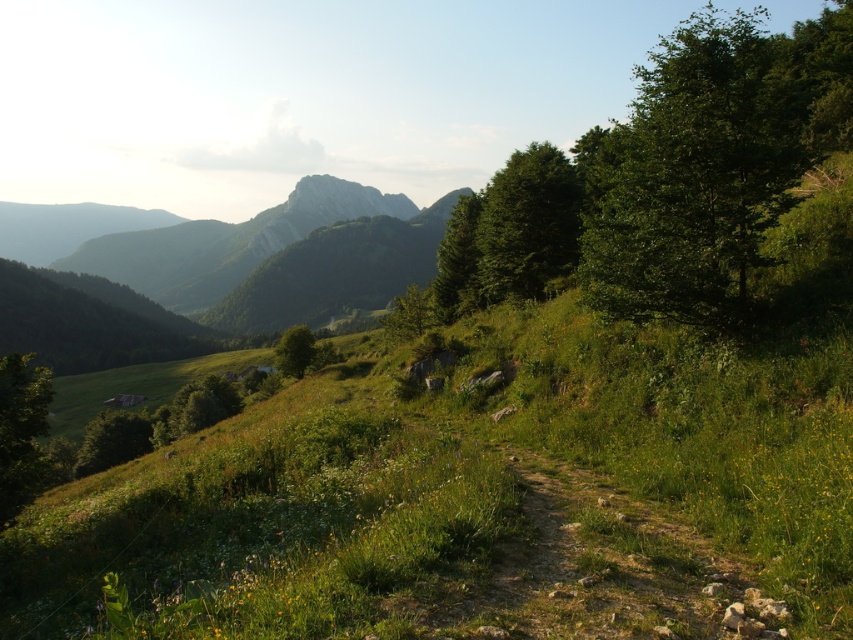
Question: Which of the following is the farthest from the observer?

Choices:
 (A) dirt/gravel path at center
 (B) rugged granite mountain at upper center

Answer: (B)

Question: Among these objects, which one is farthest from the camera?

Choices:
 (A) green leafy tree at lower left
 (B) rugged granite mountain at upper center

Answer: (B)

Question: Is rugged granite mountain at upper center wider than green leafy tree at center?

Choices:
 (A) yes
 (B) no

Answer: (A)

Question: Does green leafy tree at right have a smaller size compared to rugged granite mountain at upper center?

Choices:
 (A) no
 (B) yes

Answer: (A)

Question: Which point is closer to the camera?

Choices:
 (A) [x=641, y=212]
 (B) [x=285, y=364]
 (C) [x=44, y=404]
 (D) [x=294, y=204]

Answer: (A)

Question: Is green grassy at lower left to the right of green leafy tree at right from the viewer's perspective?

Choices:
 (A) no
 (B) yes

Answer: (A)